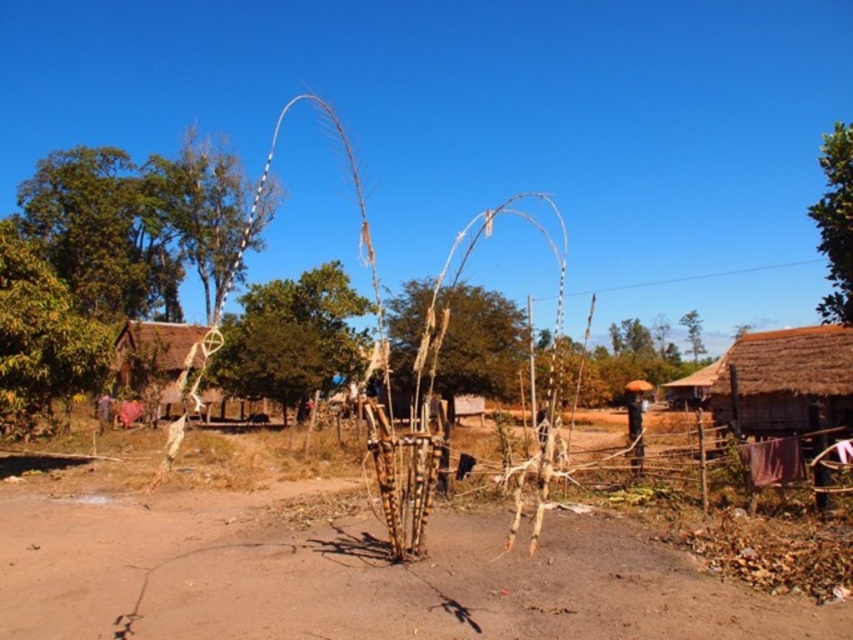
Question: Among these objects, which one is farthest from the camera?

Choices:
 (A) thatched straw hut at right
 (B) brown rough tree at center
 (C) green leafy tree at upper right
 (D) thatched straw hut at left

Answer: (B)

Question: Which point is farther to the camera?

Choices:
 (A) (415, 337)
 (B) (167, 163)

Answer: (B)

Question: Is green leafy tree at left to the right of green leafy tree at upper right from the viewer's perspective?

Choices:
 (A) no
 (B) yes

Answer: (A)

Question: Which object is positioned closest to the green leafy tree at center?

Choices:
 (A) green leafy tree at left
 (B) brown rough tree at center
 (C) thatched straw hut at left

Answer: (B)

Question: Does brown dirt track at center have a smaller size compared to thatched straw hut at left?

Choices:
 (A) no
 (B) yes

Answer: (B)

Question: Can you confirm if brown dirt track at center is wider than brown rough tree at center?

Choices:
 (A) no
 (B) yes

Answer: (B)